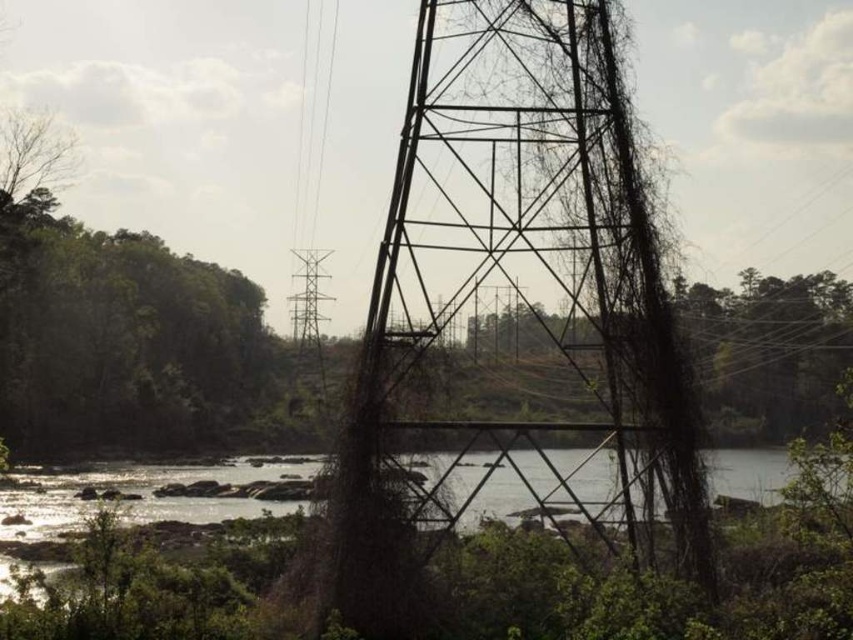
Question: Where is bare branches at upper left located in relation to metallic wire tower at center in the image?

Choices:
 (A) below
 (B) above

Answer: (B)

Question: Which object is the closest to the bare branches at upper left?

Choices:
 (A) rusty metal tower at center
 (B) metallic wire tower at center

Answer: (B)

Question: Can you confirm if rusty metal tower at center is wider than bare branches at upper left?

Choices:
 (A) no
 (B) yes

Answer: (B)

Question: Considering the real-world distances, which object is farthest from the rusty metal tower at center?

Choices:
 (A) metallic wire tower at center
 (B) bare branches at upper left

Answer: (B)

Question: From the image, what is the correct spatial relationship of rusty metal tower at center in relation to metallic wire tower at center?

Choices:
 (A) below
 (B) above

Answer: (B)

Question: Which point appears farthest from the camera in this image?

Choices:
 (A) (309, 314)
 (B) (627, 300)

Answer: (A)